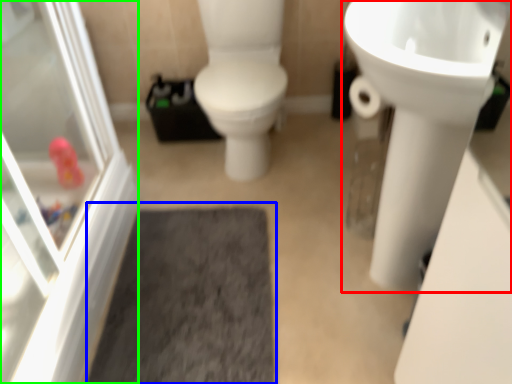
Question: Which is farther away from sink (highlighted by a red box)? bath mat (highlighted by a blue box) or screen door (highlighted by a green box)?

Choices:
 (A) bath mat
 (B) screen door

Answer: (B)